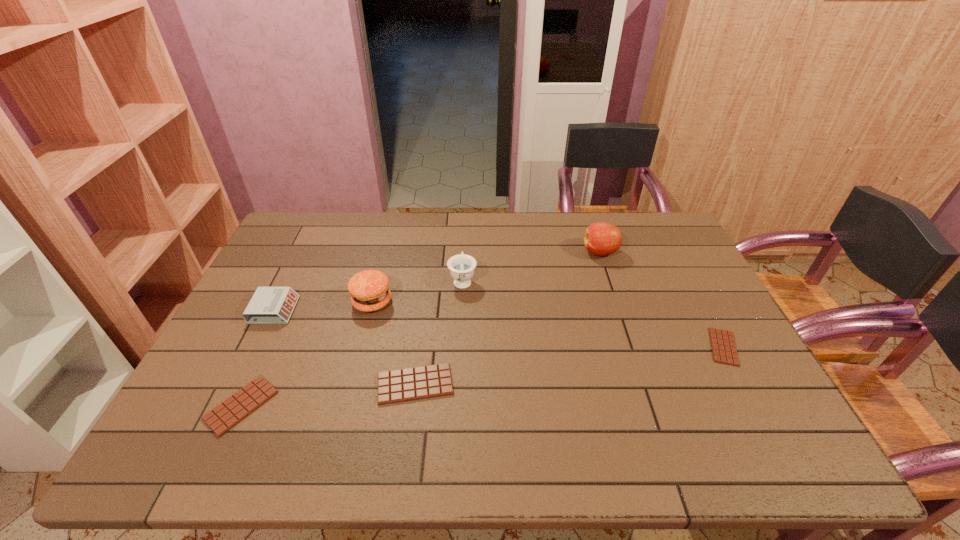
Locate an element on the screen. teacup is located at coordinates (461, 266).

Locate an element on the screen. The height and width of the screenshot is (540, 960). free space located 0.050m on the left of the second tallest candy bar is located at coordinates click(x=188, y=406).

Where is `vacant area situated on the back of the second candy bar from left to right`? This screenshot has width=960, height=540. vacant area situated on the back of the second candy bar from left to right is located at coordinates (430, 274).

Where is `vacant space located on the left of the shortest object`? The width and height of the screenshot is (960, 540). vacant space located on the left of the shortest object is located at coordinates (687, 347).

Identify the location of vacant space situated on the front of the fourth shortest object. The height and width of the screenshot is (540, 960). (222, 417).

Find the location of a particular element. The width and height of the screenshot is (960, 540). vacant region located on the right of the apple is located at coordinates (656, 252).

This screenshot has height=540, width=960. What are the coordinates of `vacant space situated 0.170m on the left of the patty` in the screenshot? It's located at (295, 302).

Identify the location of vacant region located on the side of the teacup with the handle. (465, 240).

You are a GUI agent. You are given a task and a screenshot of the screen. Output one action in this format:
    pyautogui.click(x=<x>, y=<y>)
    Task: Click on the vacant space positioned 0.280m on the side of the teacup with the handle
    The width and height of the screenshot is (960, 540).
    Given the screenshot: What is the action you would take?
    pyautogui.click(x=466, y=220)

Locate an element on the screen. Image resolution: width=960 pixels, height=540 pixels. blank space located on the side of the teacup with the handle is located at coordinates 465,229.